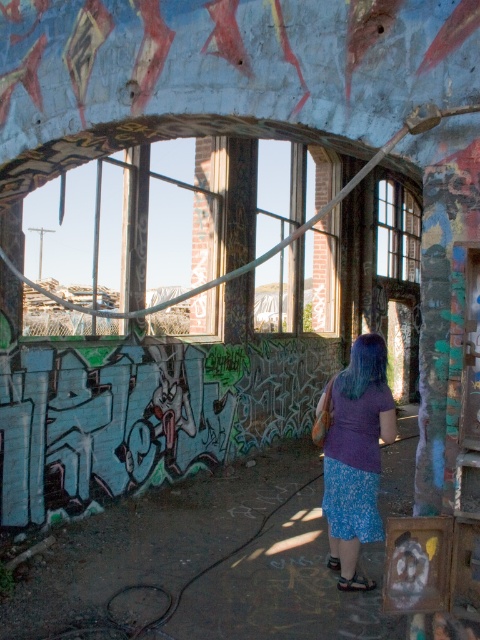
Can you confirm if purple fabric skirt at center is taller than clear glass window at center?

In fact, purple fabric skirt at center may be shorter than clear glass window at center.

Does purple fabric skirt at center have a larger size compared to clear glass window at center?

No, purple fabric skirt at center is not bigger than clear glass window at center.

Is point (339, 496) behind point (408, 262)?

That is False.

What are the coordinates of `purple fabric skirt at center` in the screenshot? It's located at (356, 456).